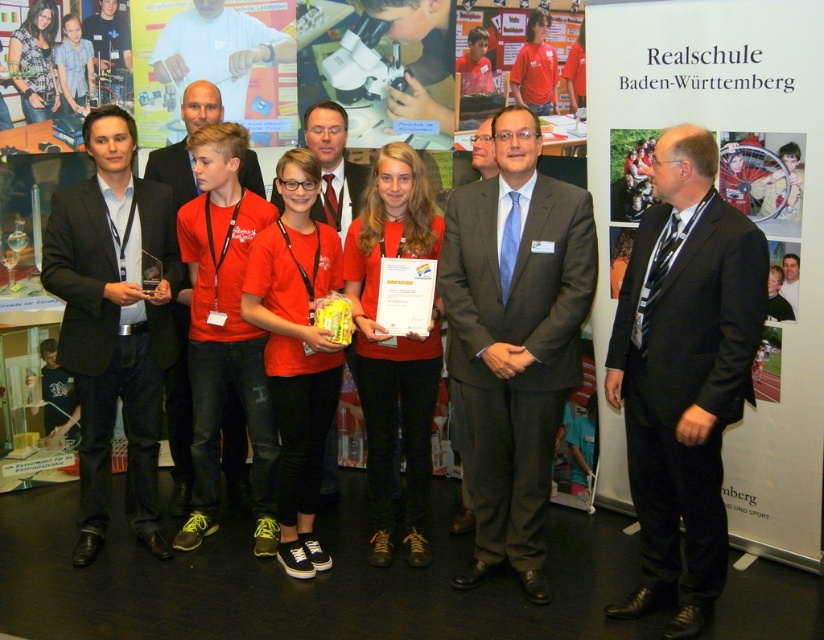
Question: Does matte black suit at left have a greater width compared to matte red shirt at center?

Choices:
 (A) no
 (B) yes

Answer: (B)

Question: Does black suit at center have a lesser width compared to dark gray suit at center?

Choices:
 (A) yes
 (B) no

Answer: (A)

Question: Among these objects, which one is farthest from the camera?

Choices:
 (A) matte black suit at left
 (B) black suit at center
 (C) matte red shirt at center
 (D) dark gray suit at center

Answer: (C)

Question: Is black suit at center positioned behind matte red shirt at center?

Choices:
 (A) no
 (B) yes

Answer: (A)

Question: Which point is closer to the camera taking this photo?

Choices:
 (A) (640, 390)
 (B) (185, 445)

Answer: (A)

Question: Among these points, which one is farthest from the camera?

Choices:
 (A) (151, 298)
 (B) (211, 106)

Answer: (B)